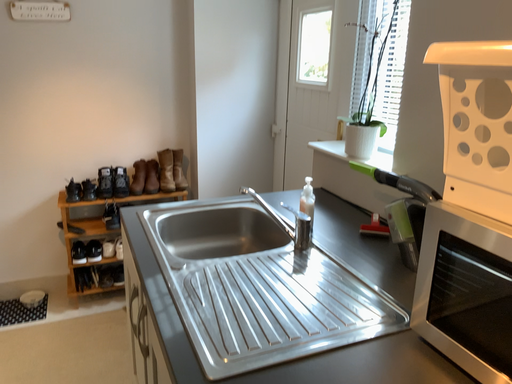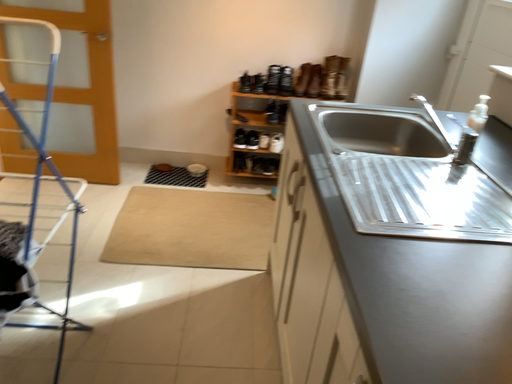
Question: Which way did the camera rotate in the video?

Choices:
 (A) rotated upward
 (B) rotated downward

Answer: (B)